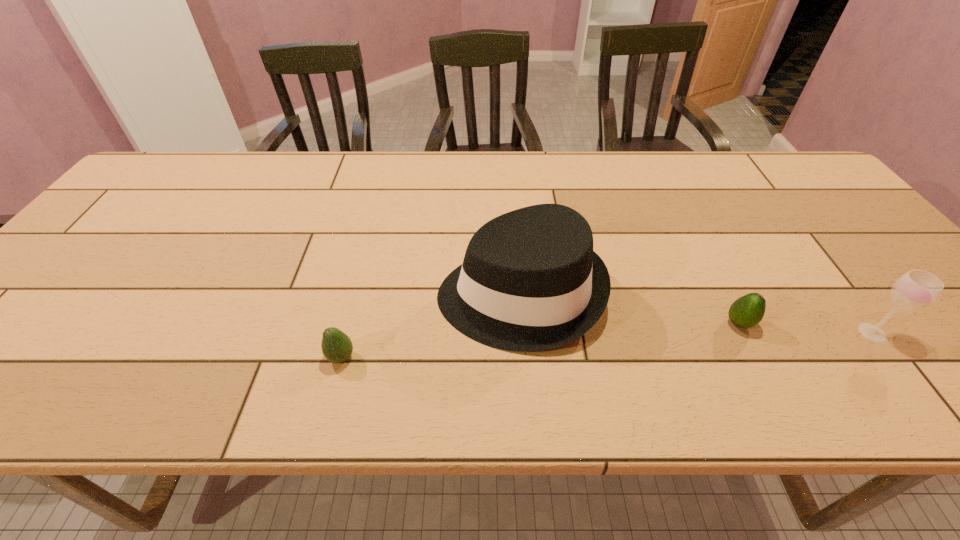
The width and height of the screenshot is (960, 540). I want to click on the second object from left to right, so click(x=530, y=281).

Image resolution: width=960 pixels, height=540 pixels. Identify the location of fedora. (530, 281).

Identify the location of wineglass. (916, 289).

This screenshot has width=960, height=540. What are the coordinates of `the third shortest object` in the screenshot? It's located at (916, 289).

Identify the location of the farther avocado. (747, 311).

Find the location of a particular element. Image resolution: width=960 pixels, height=540 pixels. the right avocado is located at coordinates (747, 311).

What are the coordinates of `the nearer avocado` in the screenshot? It's located at (337, 347).

This screenshot has height=540, width=960. Find the location of `the leftmost object`. the leftmost object is located at coordinates (337, 347).

You are a GUI agent. You are given a task and a screenshot of the screen. Output one action in this format:
    pyautogui.click(x=<x>, y=<y>)
    Task: Click on the free spot located on the left of the third object from right to left
    This screenshot has width=960, height=540.
    Given the screenshot: What is the action you would take?
    pyautogui.click(x=349, y=294)

Where is `vacant space located 0.110m on the left of the rightmost object`? This screenshot has width=960, height=540. vacant space located 0.110m on the left of the rightmost object is located at coordinates 805,333.